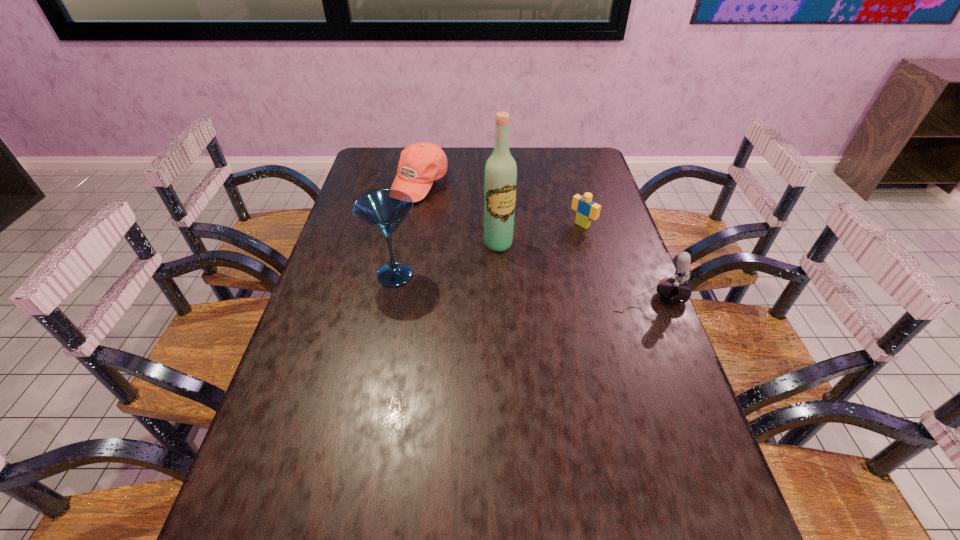
Locate an element on the screen. vacant position located on the front-facing side of the baseball cap is located at coordinates (493, 260).

I want to click on free space located 0.070m on the front-facing side of the baseball cap, so click(x=444, y=212).

Find the location of a particular element. The image size is (960, 540). vacant space located on the front-facing side of the third object from right to left is located at coordinates (511, 263).

What are the coordinates of `free point located on the front-facing side of the third object from right to left` in the screenshot? It's located at (514, 267).

Find the location of a particular element. The height and width of the screenshot is (540, 960). vacant space located 0.340m on the front-facing side of the third object from right to left is located at coordinates (558, 336).

Locate an element on the screen. The image size is (960, 540). vacant space located 0.110m on the face of the fourth nearest object is located at coordinates (553, 246).

This screenshot has width=960, height=540. I want to click on vacant area located 0.080m on the face of the fourth nearest object, so click(x=559, y=241).

Locate an element on the screen. The height and width of the screenshot is (540, 960). free region located on the face of the fourth nearest object is located at coordinates (563, 239).

Image resolution: width=960 pixels, height=540 pixels. I want to click on object at the far edge, so click(420, 164).

You are a GUI agent. You are given a task and a screenshot of the screen. Output one action in this format:
    pyautogui.click(x=<x>, y=<y>)
    Task: Click on the martini located at the left edge
    
    Given the screenshot: What is the action you would take?
    pyautogui.click(x=384, y=210)